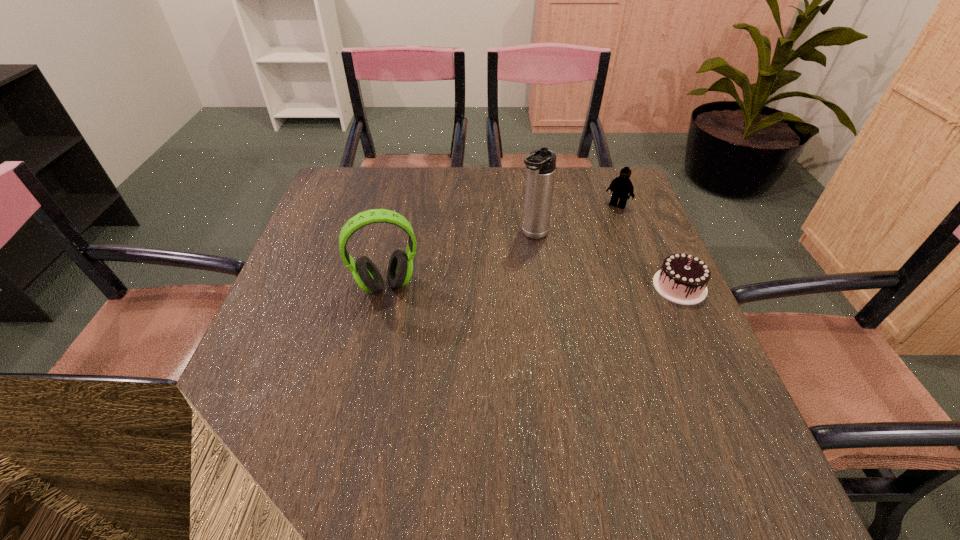
At what (x,y) coordinates should I click in order to perform the action: click on headset. Please return your answer as a coordinate pair (x, y). Image resolution: width=960 pixels, height=540 pixels. Looking at the image, I should click on (367, 276).

Image resolution: width=960 pixels, height=540 pixels. I want to click on the leftmost object, so click(x=367, y=276).

In order to click on the shortest object in this screenshot , I will do `click(683, 279)`.

Identify the location of Lego. The width and height of the screenshot is (960, 540). (621, 186).

This screenshot has height=540, width=960. I want to click on the second shortest object, so click(x=621, y=186).

You are a GUI agent. You are given a task and a screenshot of the screen. Output one action in this format:
    pyautogui.click(x=<x>, y=<y>)
    Task: Click on the third nearest object
    
    Given the screenshot: What is the action you would take?
    pyautogui.click(x=541, y=163)

Identify the location of thermos bottle. (541, 163).

This screenshot has height=540, width=960. Find the location of `blank area located on the right of the leftmost object`. blank area located on the right of the leftmost object is located at coordinates (549, 285).

This screenshot has width=960, height=540. In order to click on blank space located on the back of the chocolate cake in this screenshot , I will do (x=658, y=238).

This screenshot has height=540, width=960. In order to click on vacant region located on the face of the second shortest object in this screenshot , I will do `click(581, 253)`.